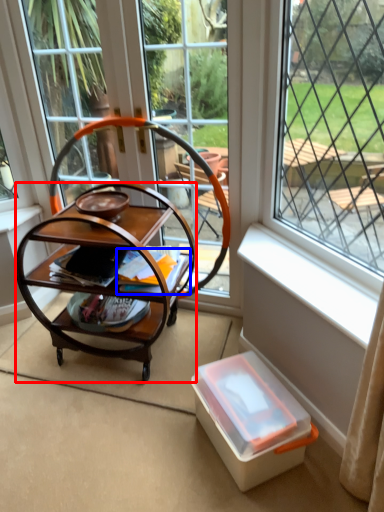
Question: Among these objects, which one is farthest to the camera, desk (highlighted by a red box) or magazine (highlighted by a blue box)?

Choices:
 (A) desk
 (B) magazine

Answer: (B)